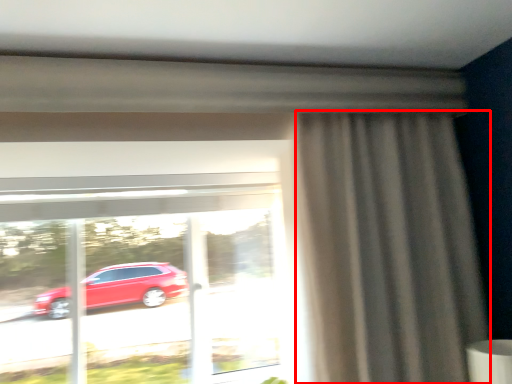
Question: From the image's perspective, what is the correct spatial relationship of curtain (annotated by the red box) in relation to window?

Choices:
 (A) above
 (B) below

Answer: (A)